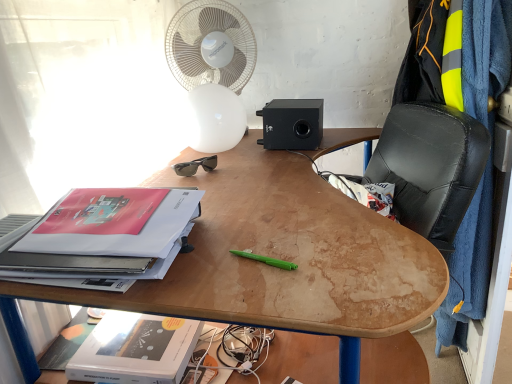
Question: Does black leather computer chair at center have a lesser height compared to black plastic sunglasses at upper center?

Choices:
 (A) yes
 (B) no

Answer: (B)

Question: Is black leather computer chair at center far away from black plastic sunglasses at upper center?

Choices:
 (A) yes
 (B) no

Answer: (B)

Question: Can you see black leather computer chair at center touching black plastic sunglasses at upper center?

Choices:
 (A) no
 (B) yes

Answer: (A)

Question: Is black leather computer chair at center in front of black plastic sunglasses at upper center?

Choices:
 (A) yes
 (B) no

Answer: (A)

Question: Is black leather computer chair at center positioned beyond the bounds of black plastic sunglasses at upper center?

Choices:
 (A) no
 (B) yes

Answer: (B)

Question: Considering the positions of wooden desk at center and white plastic fan at upper center in the image, is wooden desk at center taller or shorter than white plastic fan at upper center?

Choices:
 (A) tall
 (B) short

Answer: (A)

Question: In terms of width, does wooden desk at center look wider or thinner when compared to white plastic fan at upper center?

Choices:
 (A) wide
 (B) thin

Answer: (A)

Question: Does point (358, 289) appear closer or farther from the camera than point (236, 135)?

Choices:
 (A) farther
 (B) closer

Answer: (B)

Question: Considering the positions of wooden desk at center and white plastic fan at upper center in the image, is wooden desk at center bigger or smaller than white plastic fan at upper center?

Choices:
 (A) big
 (B) small

Answer: (A)

Question: Is blue fleece blanket at right taller or shorter than green plastic pen at center?

Choices:
 (A) short
 (B) tall

Answer: (B)

Question: From a real-world perspective, is blue fleece blanket at right physically located above or below green plastic pen at center?

Choices:
 (A) below
 (B) above

Answer: (A)

Question: Looking at the image, does blue fleece blanket at right seem bigger or smaller compared to green plastic pen at center?

Choices:
 (A) big
 (B) small

Answer: (A)

Question: Is point (467, 107) positioned closer to the camera than point (262, 261)?

Choices:
 (A) farther
 (B) closer

Answer: (A)

Question: Does point (291, 109) appear closer or farther from the camera than point (429, 9)?

Choices:
 (A) farther
 (B) closer

Answer: (A)

Question: From a real-world perspective, is black plastic speaker at upper center positioned above or below blue fleece blanket at right?

Choices:
 (A) below
 (B) above

Answer: (B)